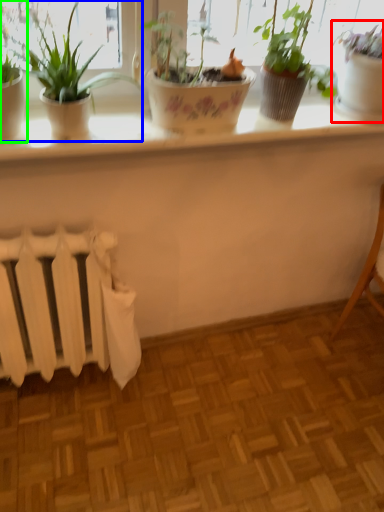
Question: Considering the real-world distances, which object is farthest from houseplant (highlighted by a red box)? houseplant (highlighted by a blue box) or houseplant (highlighted by a green box)?

Choices:
 (A) houseplant
 (B) houseplant

Answer: (B)